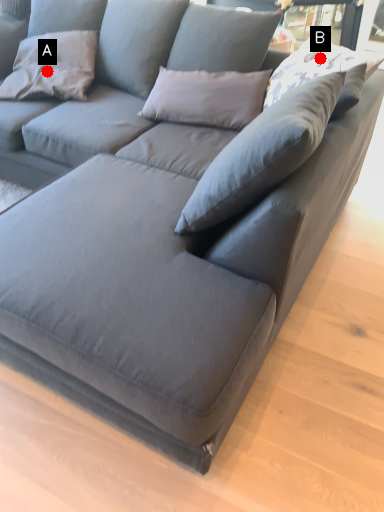
Question: Two points are circled on the image, labeled by A and B beside each circle. Which point is closer to the camera taking this photo?

Choices:
 (A) A is closer
 (B) B is closer

Answer: (B)